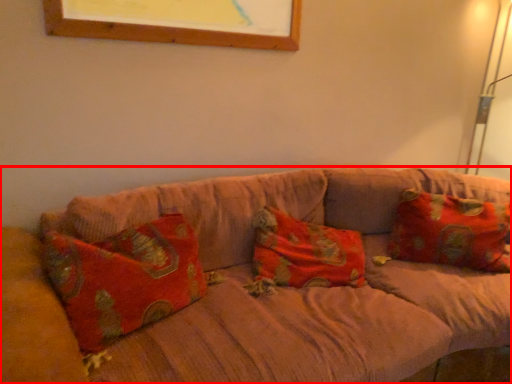
Question: Where is studio couch (annotated by the red box) located in relation to pillow in the image?

Choices:
 (A) left
 (B) right

Answer: (A)